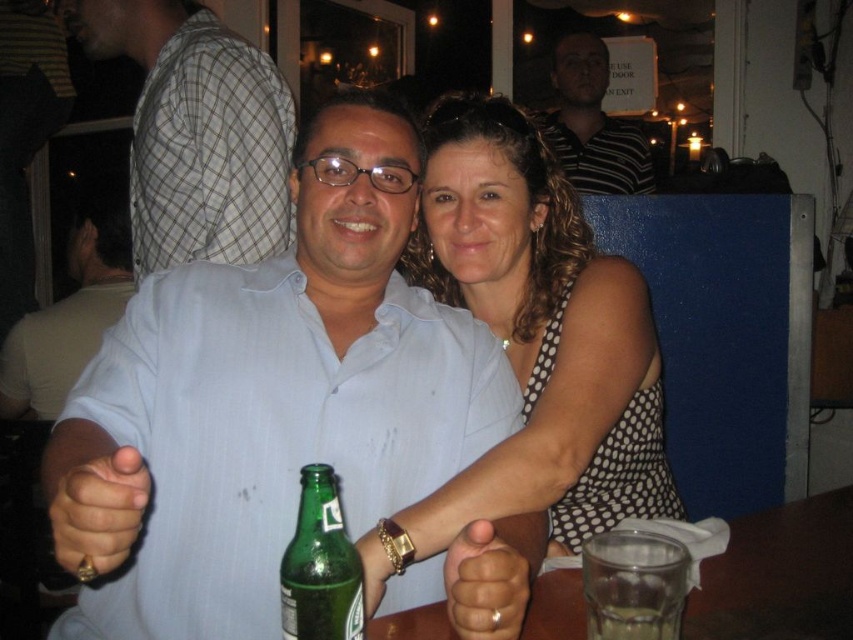
Does black dotted dress at center appear under gold metallic ring at center?

Incorrect, black dotted dress at center is not positioned below gold metallic ring at center.

Who is more forward, (602,348) or (495,538)?

Positioned in front is point (495,538).

Which is behind, point (489, 205) or point (519, 595)?

Point (489, 205)

Find the location of a particular element. The width and height of the screenshot is (853, 640). black dotted dress at center is located at coordinates (532, 344).

Can you confirm if gold metallic ring at center is smaller than translucent glass at lower right?

Incorrect, gold metallic ring at center is not smaller in size than translucent glass at lower right.

Does point (491, 605) come in front of point (645, 632)?

No.

Is point (518, 529) more distant than point (622, 620)?

Yes, point (518, 529) is farther from viewer.

The width and height of the screenshot is (853, 640). I want to click on gold metallic ring at center, so click(x=492, y=573).

Is gold ring at center in front of translucent glass at lower right?

Yes, gold ring at center is closer to the viewer.

Which is behind, point (73, 460) or point (611, 621)?

Positioned behind is point (73, 460).

Is point (53, 452) positioned before point (598, 614)?

That is False.

Identify the location of gold ring at center. The width and height of the screenshot is (853, 640). (91, 497).